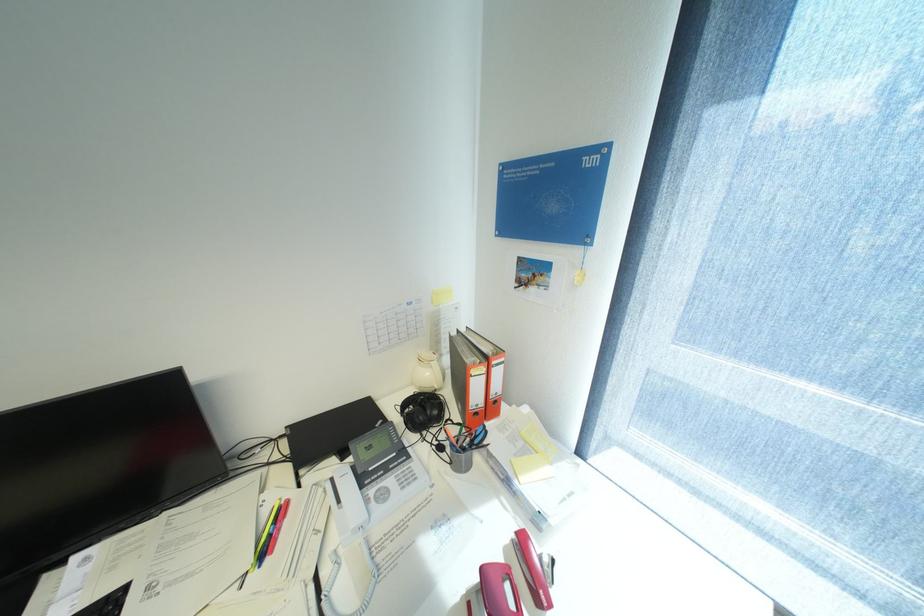
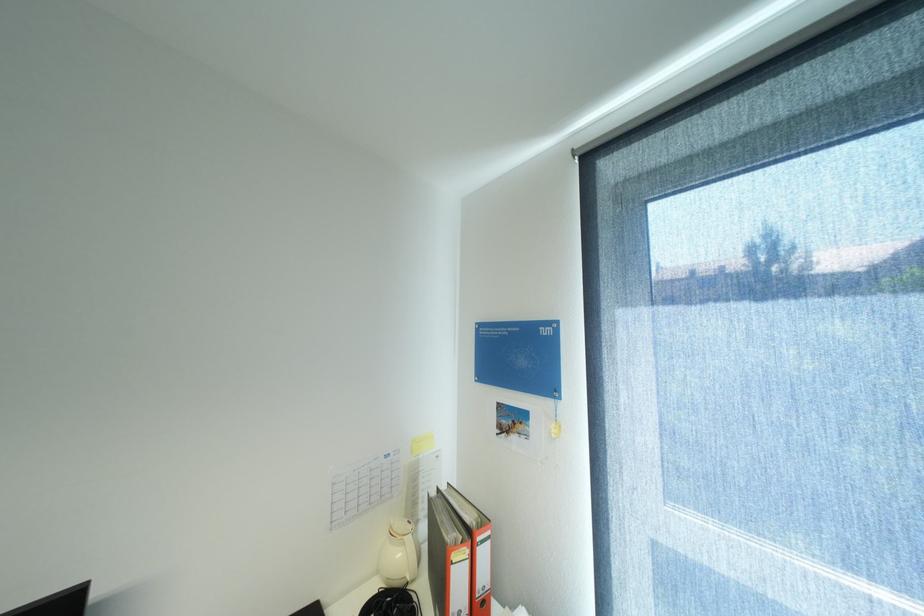
Find the pixel in the second image that matches (436,374) in the first image.

(407, 554)